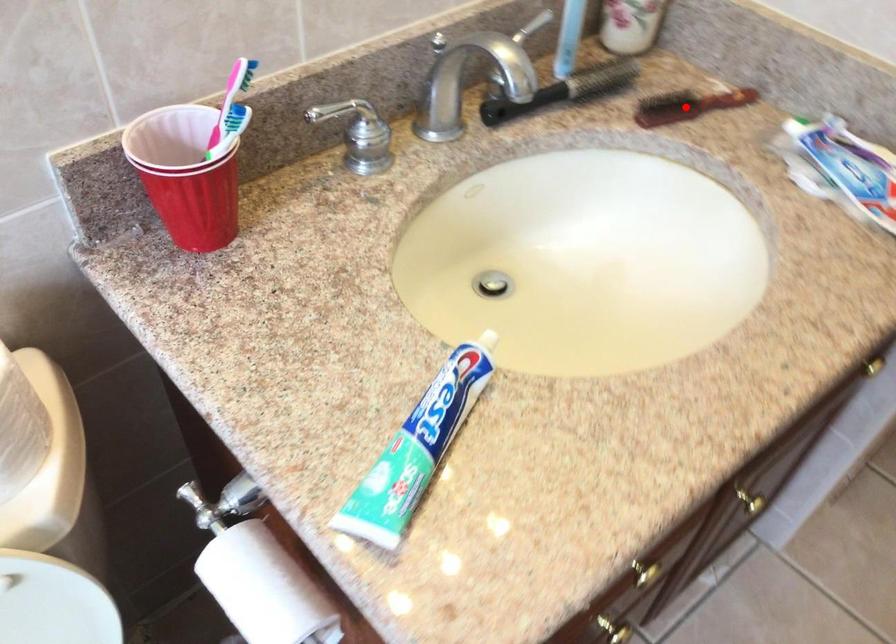
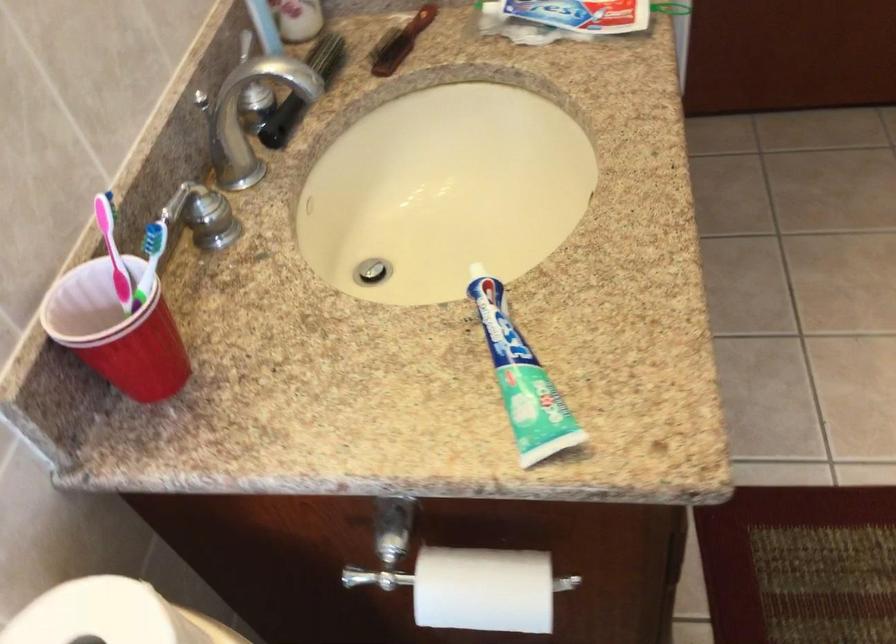
Locate, in the second image, the point that corresponds to the highlighted location in the first image.

(400, 42)